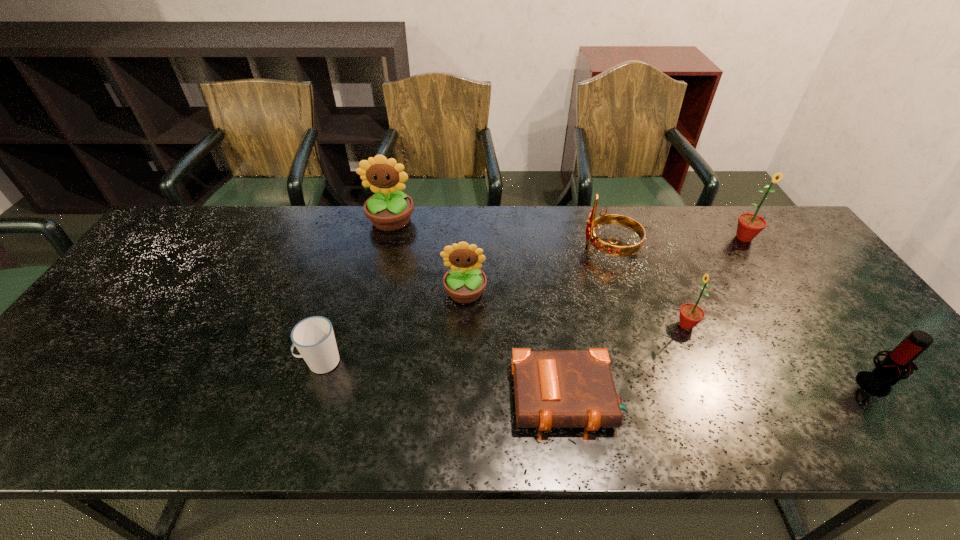
At what (x,y) coordinates should I click in order to perform the action: click on object that is positioned at the far right corner. Please return your answer as a coordinate pair (x, y). Looking at the image, I should click on (749, 225).

In the image, there is a desktop. Identify the location of vacant space at the far edge. (571, 248).

Locate an element on the screen. This screenshot has width=960, height=540. free space at the near edge of the desktop is located at coordinates (608, 436).

The width and height of the screenshot is (960, 540). In order to click on vacant space at the left edge of the desktop in this screenshot , I will do `click(132, 301)`.

In the image, there is a desktop. Identify the location of free space at the near left corner. This screenshot has width=960, height=540. (53, 408).

I want to click on blank region between the red tiara and the fourth nearest object, so click(x=648, y=286).

At what (x,y) coordinates should I click in order to perform the action: click on vacant area that lies between the leftmost sunflower and the Bible. Please return your answer as a coordinate pair (x, y). Looking at the image, I should click on (479, 309).

Where is `free space between the red tiara and the fifth farthest object`? free space between the red tiara and the fifth farthest object is located at coordinates point(648,286).

The image size is (960, 540). What are the coordinates of `vacant region between the rightmost sunflower and the shortest object` in the screenshot? It's located at (656, 318).

Where is `free space that is in between the Bible and the smaller green sunflower`? Image resolution: width=960 pixels, height=540 pixels. free space that is in between the Bible and the smaller green sunflower is located at coordinates (627, 361).